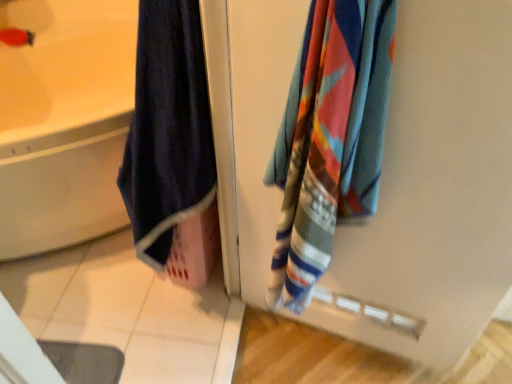
Question: Is matte white bathtub at left wider than multicolored woven towel at right?

Choices:
 (A) yes
 (B) no

Answer: (A)

Question: From a real-world perspective, is matte white bathtub at left on top of multicolored woven towel at right?

Choices:
 (A) yes
 (B) no

Answer: (B)

Question: From a real-world perspective, is matte white bathtub at left beneath multicolored woven towel at right?

Choices:
 (A) yes
 (B) no

Answer: (A)

Question: Is matte white bathtub at left thinner than multicolored woven towel at right?

Choices:
 (A) no
 (B) yes

Answer: (A)

Question: Would you say matte white bathtub at left is a long distance from multicolored woven towel at right?

Choices:
 (A) yes
 (B) no

Answer: (A)

Question: Is matte white bathtub at left taller than multicolored woven towel at right?

Choices:
 (A) yes
 (B) no

Answer: (B)

Question: Could you tell me if multicolored woven towel at right is turned towards matte white bathtub at left?

Choices:
 (A) yes
 (B) no

Answer: (B)

Question: Is multicolored woven towel at right beside matte white bathtub at left?

Choices:
 (A) yes
 (B) no

Answer: (B)

Question: Is multicolored woven towel at right located outside matte white bathtub at left?

Choices:
 (A) no
 (B) yes

Answer: (B)

Question: Does multicolored woven towel at right come in front of matte white bathtub at left?

Choices:
 (A) no
 (B) yes

Answer: (B)

Question: Does multicolored woven towel at right have a lesser height compared to matte white bathtub at left?

Choices:
 (A) yes
 (B) no

Answer: (B)

Question: Does multicolored woven towel at right have a larger size compared to matte white bathtub at left?

Choices:
 (A) yes
 (B) no

Answer: (B)

Question: In the image, is matte white bathtub at left positioned in front of or behind multicolored woven towel at right?

Choices:
 (A) behind
 (B) front

Answer: (A)